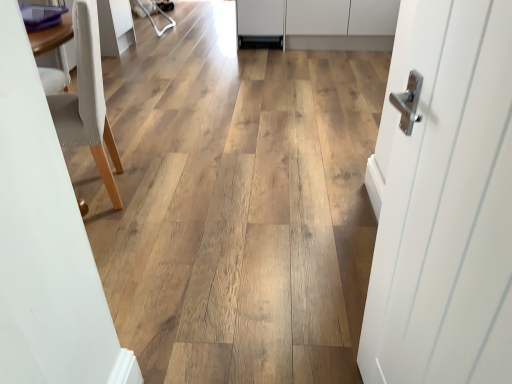
Question: Does light beige fabric chair at left have a greater width compared to white smooth door at right?

Choices:
 (A) no
 (B) yes

Answer: (B)

Question: Could you tell me if light beige fabric chair at left is turned towards white smooth door at right?

Choices:
 (A) no
 (B) yes

Answer: (A)

Question: Is light beige fabric chair at left in front of white smooth door at right?

Choices:
 (A) yes
 (B) no

Answer: (B)

Question: Is light beige fabric chair at left at the right side of white smooth door at right?

Choices:
 (A) yes
 (B) no

Answer: (B)

Question: Considering the relative positions of light beige fabric chair at left and white smooth door at right in the image provided, is light beige fabric chair at left to the left of white smooth door at right from the viewer's perspective?

Choices:
 (A) yes
 (B) no

Answer: (A)

Question: Considering the positions of white matte cabinet at upper center and white smooth door at right in the image, is white matte cabinet at upper center wider or thinner than white smooth door at right?

Choices:
 (A) thin
 (B) wide

Answer: (B)

Question: In terms of height, does white matte cabinet at upper center look taller or shorter compared to white smooth door at right?

Choices:
 (A) tall
 (B) short

Answer: (B)

Question: Would you say white matte cabinet at upper center is inside or outside white smooth door at right?

Choices:
 (A) inside
 (B) outside

Answer: (B)

Question: Is point (385, 34) positioned closer to the camera than point (451, 223)?

Choices:
 (A) farther
 (B) closer

Answer: (A)

Question: In terms of size, does light beige fabric chair at left appear bigger or smaller than white matte cabinet at upper center?

Choices:
 (A) small
 (B) big

Answer: (A)

Question: From a real-world perspective, is light beige fabric chair at left above or below white matte cabinet at upper center?

Choices:
 (A) below
 (B) above

Answer: (B)

Question: From the image's perspective, is light beige fabric chair at left located above or below white matte cabinet at upper center?

Choices:
 (A) above
 (B) below

Answer: (B)

Question: In the image, is light beige fabric chair at left positioned in front of or behind white matte cabinet at upper center?

Choices:
 (A) front
 (B) behind

Answer: (A)

Question: In terms of size, does light beige fabric chair at left appear bigger or smaller than white smooth door at right?

Choices:
 (A) small
 (B) big

Answer: (B)

Question: From a real-world perspective, is light beige fabric chair at left above or below white smooth door at right?

Choices:
 (A) above
 (B) below

Answer: (B)